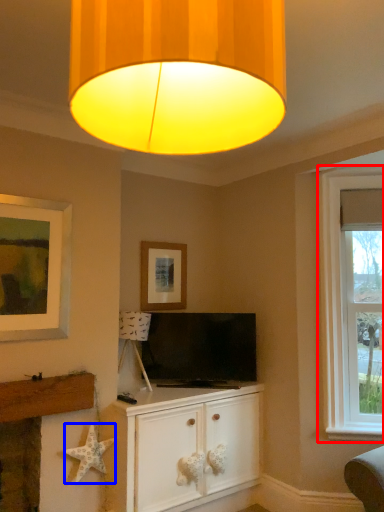
Question: Which object appears closest to the camera in this image, window (highlighted by a red box) or starfish (highlighted by a blue box)?

Choices:
 (A) window
 (B) starfish

Answer: (B)